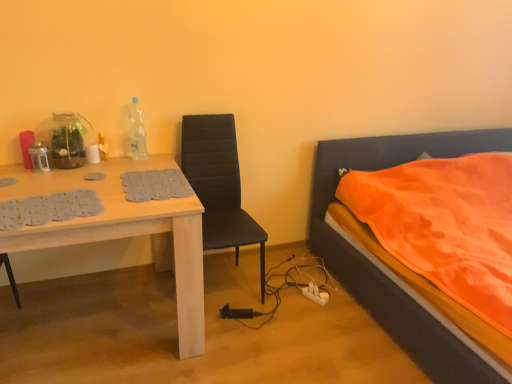
Identify the location of vacant area in front of black leather chair at center. (241, 348).